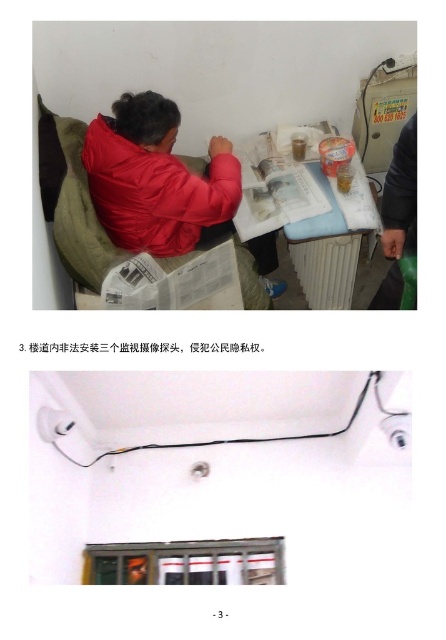
Question: Which point is farther to the camera?

Choices:
 (A) (94, 186)
 (B) (389, 204)
 (C) (120, 301)
 (D) (313, 260)

Answer: (D)

Question: Can you confirm if white plastic table at upper center is thinner than matte black jacket at upper left?

Choices:
 (A) yes
 (B) no

Answer: (B)

Question: Based on their relative distances, which object is farther from the white glossy paper at center?

Choices:
 (A) matte red jacket at center
 (B) white plastic table at upper center

Answer: (B)

Question: Does white plastic table at upper center have a greater width compared to white glossy paper at center?

Choices:
 (A) no
 (B) yes

Answer: (B)

Question: Can you confirm if white glossy paper at center is positioned below matte black jacket at upper left?

Choices:
 (A) yes
 (B) no

Answer: (A)

Question: Among these objects, which one is nearest to the camera?

Choices:
 (A) white plastic table at upper center
 (B) matte black jacket at upper left
 (C) matte red jacket at center
 (D) white glossy paper at center

Answer: (B)